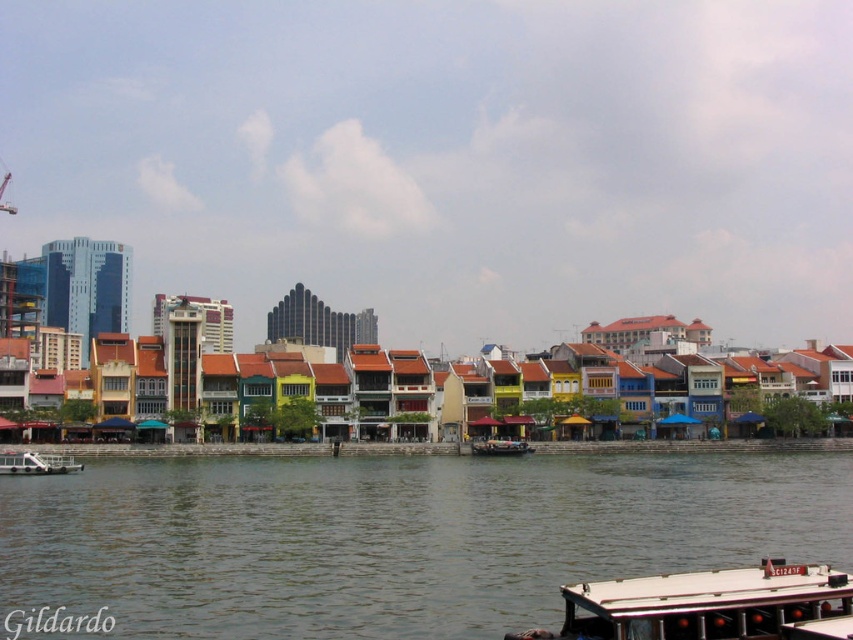
Which is in front, point (351, 547) or point (71, 468)?

Point (351, 547) is in front.

Is greenish water at lower center smaller than white plastic boat at lower left?

Actually, greenish water at lower center might be larger than white plastic boat at lower left.

Image resolution: width=853 pixels, height=640 pixels. I want to click on greenish water at lower center, so click(396, 536).

In order to click on greenish water at lower center in this screenshot , I will do `click(396, 536)`.

Is point (668, 616) more distant than point (492, 454)?

No, (668, 616) is closer to viewer.

Which of these two, white matte boat at lower right or white glossy boat at center, stands taller?

white matte boat at lower right is taller.

This screenshot has height=640, width=853. What do you see at coordinates (711, 605) in the screenshot?
I see `white matte boat at lower right` at bounding box center [711, 605].

Image resolution: width=853 pixels, height=640 pixels. Find the location of `white matte boat at lower right`. white matte boat at lower right is located at coordinates (711, 605).

Can you confirm if greenish water at lower center is wider than white glossy boat at center?

Correct, the width of greenish water at lower center exceeds that of white glossy boat at center.

Is greenish water at lower center in front of white glossy boat at center?

Yes.

This screenshot has width=853, height=640. Describe the element at coordinates (396, 536) in the screenshot. I see `greenish water at lower center` at that location.

At what (x,y) coordinates should I click in order to perform the action: click on greenish water at lower center. Please return your answer as a coordinate pair (x, y). This screenshot has height=640, width=853. Looking at the image, I should click on (396, 536).